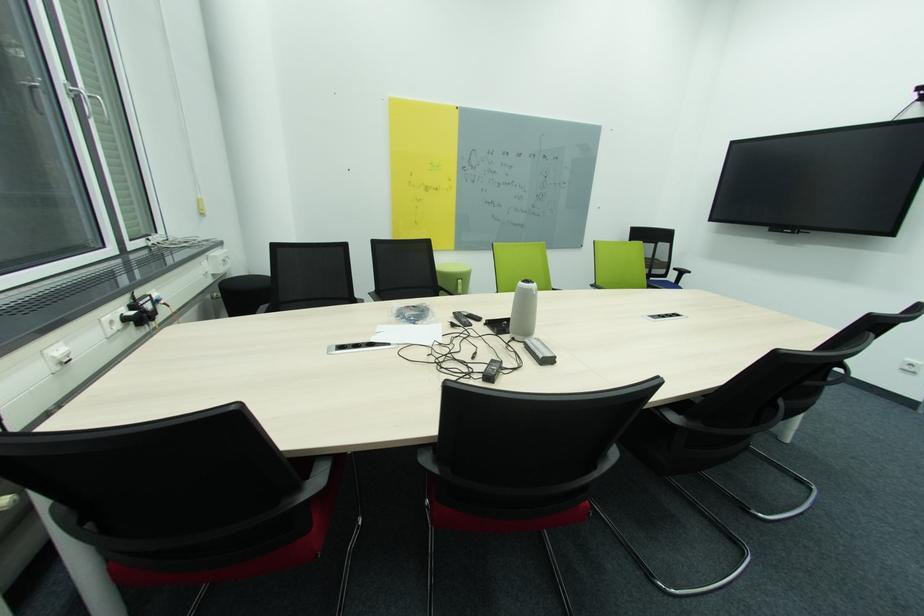
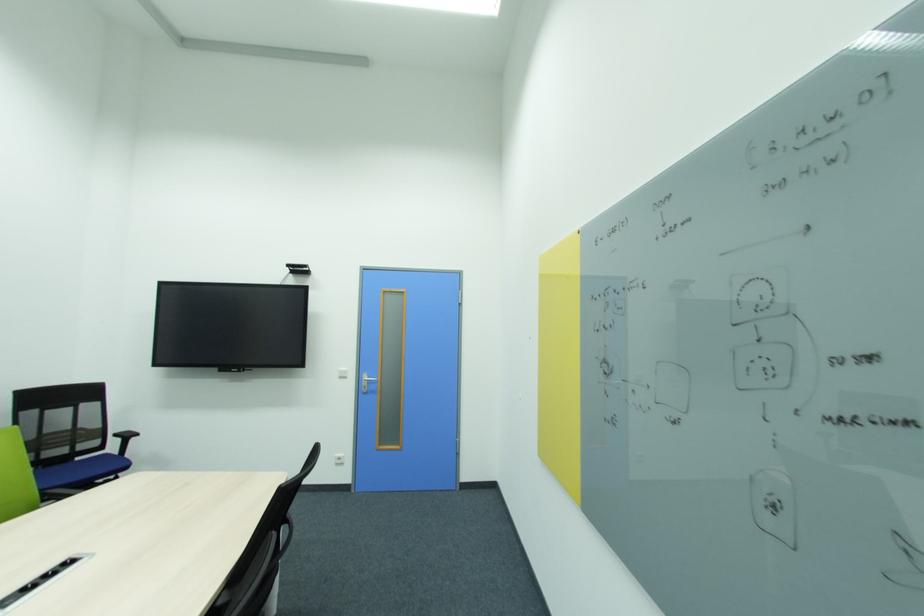
In the second image, find the point that corresponds to the point at 657,280 in the first image.

(82, 460)